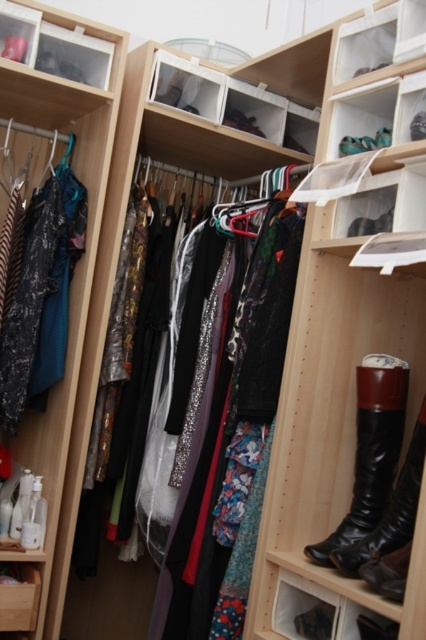
You are organizing your closet and want to place a new pair of shoes between the clear plastic storage at upper left and the floral fabric dress at center. Which object should you place the shoes closer to if you want them to be lower in the closet?

The shoes should be placed closer to the floral fabric dress at center because the clear plastic storage at upper left is located above it, making the dress lower in the closet.

You are organizing your closet and want to place a new box at the exact center of the closet. You have a clear plastic storage at upper left located at point 0.073, 0.131. Where should you place the new box to ensure it is centered?

To place the new box at the exact center of the closet, you should position it at point (213, 320) since the coordinate system typically ranges from 0 to 1 in both x and y axes, making 0.5 the midpoint in both directions.